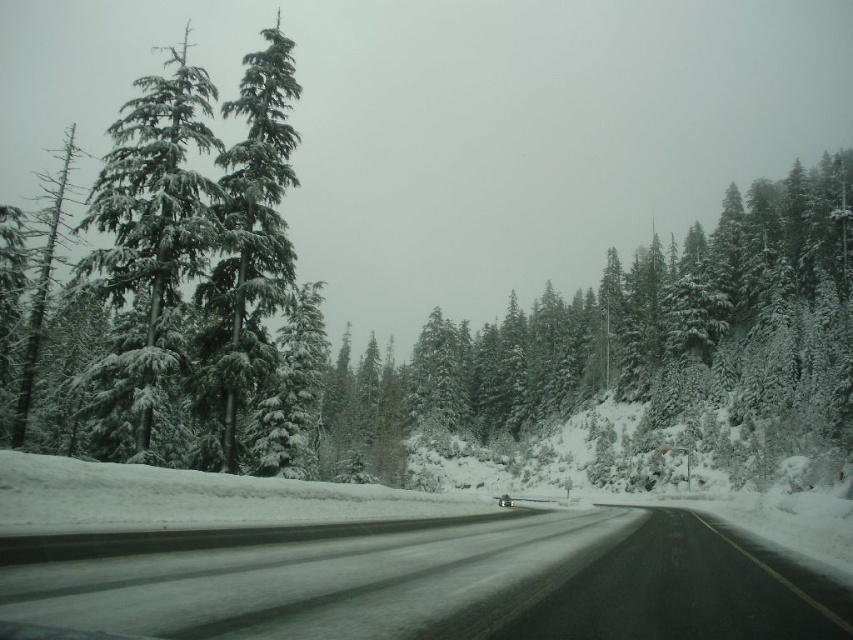
Question: Which of the following is the closest to the observer?

Choices:
 (A) snow-covered evergreen trees at center
 (B) snow-covered evergreen trees at left
 (C) snow-covered evergreen at center
 (D) black asphalt road at center

Answer: (D)

Question: Observing the image, what is the correct spatial positioning of snow-covered evergreen trees at center in reference to snow-covered evergreen trees at left?

Choices:
 (A) right
 (B) left

Answer: (A)

Question: Where is snow-covered evergreen trees at left located in relation to snow-covered evergreen at left in the image?

Choices:
 (A) below
 (B) above

Answer: (A)

Question: Which object is positioned closest to the snow-covered evergreen at center?

Choices:
 (A) snow-covered evergreen trees at center
 (B) black asphalt road at center
 (C) snow-covered evergreen trees at left

Answer: (C)

Question: Is black asphalt road at center in front of snow-covered evergreen at left?

Choices:
 (A) yes
 (B) no

Answer: (A)

Question: Based on their relative distances, which object is nearer to the black asphalt road at center?

Choices:
 (A) snow-covered evergreen at center
 (B) snow-covered evergreen trees at center

Answer: (A)